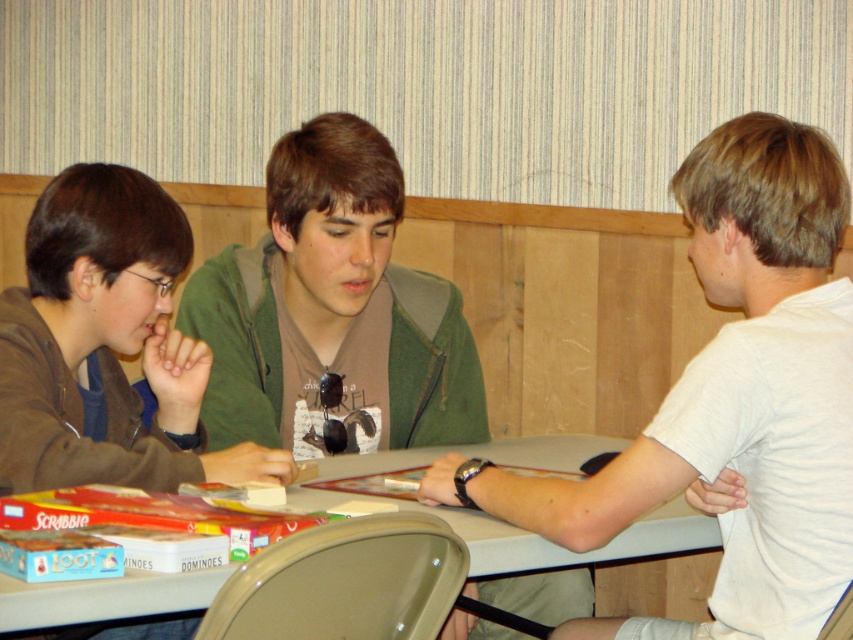
Question: Is white cotton shirt at right closer to the viewer compared to smooth plastic table at center?

Choices:
 (A) yes
 (B) no

Answer: (A)

Question: Based on their relative distances, which object is nearer to the smooth plastic table at center?

Choices:
 (A) green matte jacket at center
 (B) white cotton shirt at right

Answer: (A)

Question: Among these points, which one is nearest to the camera?

Choices:
 (A) (258, 266)
 (B) (759, 148)

Answer: (B)

Question: Estimate the real-world distances between objects in this image. Which object is closer to the white cotton shirt at right?

Choices:
 (A) green matte jacket at center
 (B) smooth plastic table at center

Answer: (B)

Question: Observing the image, what is the correct spatial positioning of white cotton shirt at right in reference to green matte jacket at center?

Choices:
 (A) below
 (B) above

Answer: (A)

Question: From the image, what is the correct spatial relationship of green matte jacket at center in relation to smooth plastic table at center?

Choices:
 (A) left
 (B) right

Answer: (A)